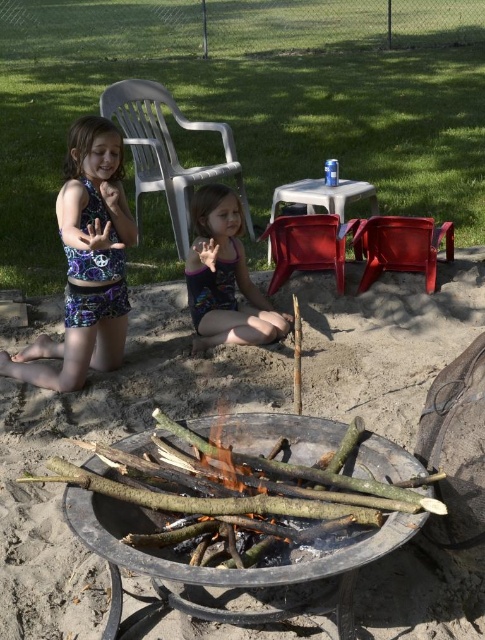
You need to choose a seat for a tall guest who is 6 feet tall. Which of the two chairs, the plastic chair at upper left or the matte plastic chair at center, would be more suitable based on their heights?

The plastic chair at upper left is much taller than the matte plastic chair at center, so the plastic chair at upper left would be more suitable for a tall guest who is 6 feet tall.

You are a parent supervising the children. You notice the printed fabric swimsuit at left and the brown sandy ground at center. Which object is higher in elevation?

The brown sandy ground at center is taller than the printed fabric swimsuit at left, so the brown sandy ground at center is higher in elevation.